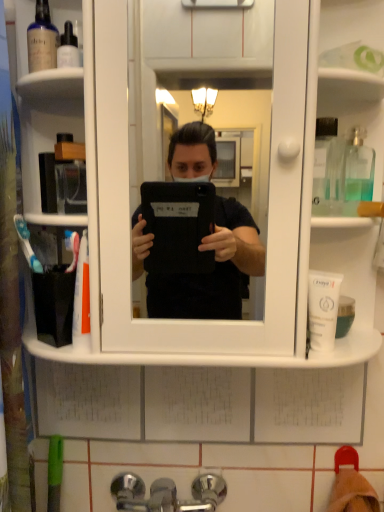
Question: Is clear glass bottle at upper right, the 3th mouthwash viewed from the left, in front of or behind white matte tube at right, marked as the 1th mouthwash in a bottom-to-top arrangement, in the image?

Choices:
 (A) behind
 (B) front

Answer: (A)

Question: Considering the relative positions of clear glass bottle at upper right, which appears as the second mouthwash when viewed from the top, and white matte tube at right, marked as the 1th mouthwash in a bottom-to-top arrangement, in the image provided, is clear glass bottle at upper right, which appears as the second mouthwash when viewed from the top, to the left or to the right of white matte tube at right, marked as the 1th mouthwash in a bottom-to-top arrangement,?

Choices:
 (A) left
 (B) right

Answer: (B)

Question: Based on their relative distances, which object is farther from the chrome metallic faucet at lower center?

Choices:
 (A) translucent glass mouthwash at upper left, which appears as the first mouthwash when viewed from the left
 (B) white matte tube at right, the third mouthwash positioned from the top
 (C) clear glass bottle at upper right, the 3th mouthwash viewed from the left
 (D) white plastic cabinet at center

Answer: (A)

Question: Estimate the real-world distances between objects in this image. Which object is farther from the white matte tube at right, which appears as the 2th mouthwash when viewed from the right?

Choices:
 (A) translucent glass mouthwash at upper left, the third mouthwash from the bottom
 (B) clear glass bottle at upper right, the 3th mouthwash viewed from the left
 (C) chrome metallic faucet at lower center
 (D) white plastic cabinet at center

Answer: (A)